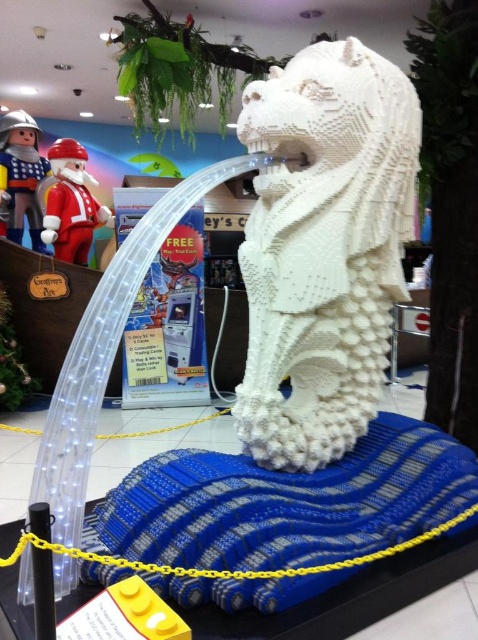
Based on the photo, measure the distance between matte plastic santa at upper left and metallic silver toy soldier at upper left.

The distance of matte plastic santa at upper left from metallic silver toy soldier at upper left is 21.71 inches.

Who is more distant from viewer, (76,257) or (25,192)?

The point (25,192) is behind.

In order to click on matte plastic santa at upper left in this screenshot , I will do `click(71, 204)`.

Does white lego sculpture at center have a greater height compared to metallic silver toy soldier at upper left?

Yes.

What are the coordinates of `white lego sculpture at center` in the screenshot? It's located at (324, 248).

Between point (303, 211) and point (13, 193), which one is positioned behind?

The point (13, 193) is behind.

The height and width of the screenshot is (640, 478). What are the coordinates of `white lego sculpture at center` in the screenshot? It's located at (324, 248).

Is point (332, 460) positioned before point (67, 168)?

Yes, it is in front of point (67, 168).

Based on the photo, is white lego sculpture at center to the left of matte plastic santa at upper left from the viewer's perspective?

In fact, white lego sculpture at center is to the right of matte plastic santa at upper left.

I want to click on white lego sculpture at center, so click(324, 248).